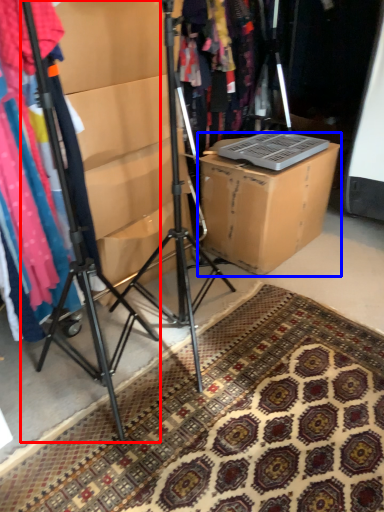
Question: Which object is further to the camera taking this photo, tripod (highlighted by a red box) or cardboard box (highlighted by a blue box)?

Choices:
 (A) tripod
 (B) cardboard box

Answer: (B)